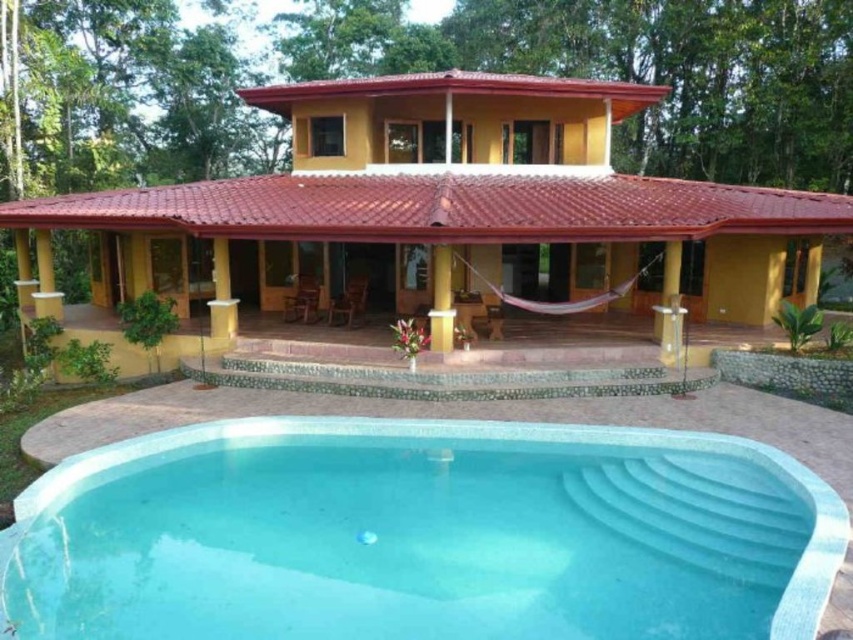
You are a maintenance worker tasked with checking the distance between the smooth concrete pool at lower center and the purple fabric hammock at center to ensure safety regulations are met. According to the guidelines, the minimum required distance between a pool and any outdoor furniture must be at least 20 feet. Can you confirm if the current distance meets the safety requirement?

The distance between the smooth concrete pool at lower center and the purple fabric hammock at center is 23.50 feet, which exceeds the minimum requirement of 20 feet. Therefore, the safety regulations are satisfied.

You are planning to hang a new purple fabric hammock at center in the backyard of the house. The existing yellow wood pillar at center is already present. Considering the height of the pillar, will the hammock be visible from the ground floor windows?

The purple fabric hammock at center is not as tall as the yellow wood pillar at center, so it will be visible from the ground floor windows since it is shorter than the pillar.

Looking at this image, you are standing at the entrance of the two story house and want to reach the purple fabric hammock at center. Which direction should you head towards?

The purple fabric hammock at center is located at point (561, 301) in the image, so you should head towards the center of the image to reach it.